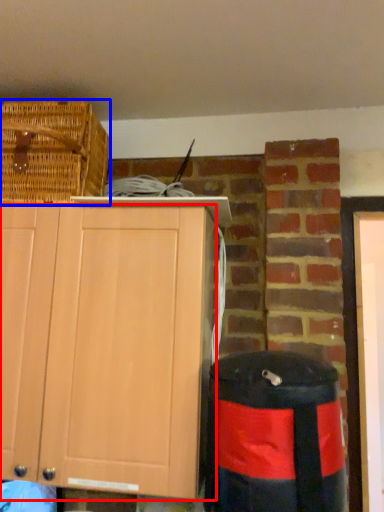
Question: Which point is further to the camera, cabinetry (highlighted by a red box) or picnic basket (highlighted by a blue box)?

Choices:
 (A) cabinetry
 (B) picnic basket

Answer: (B)